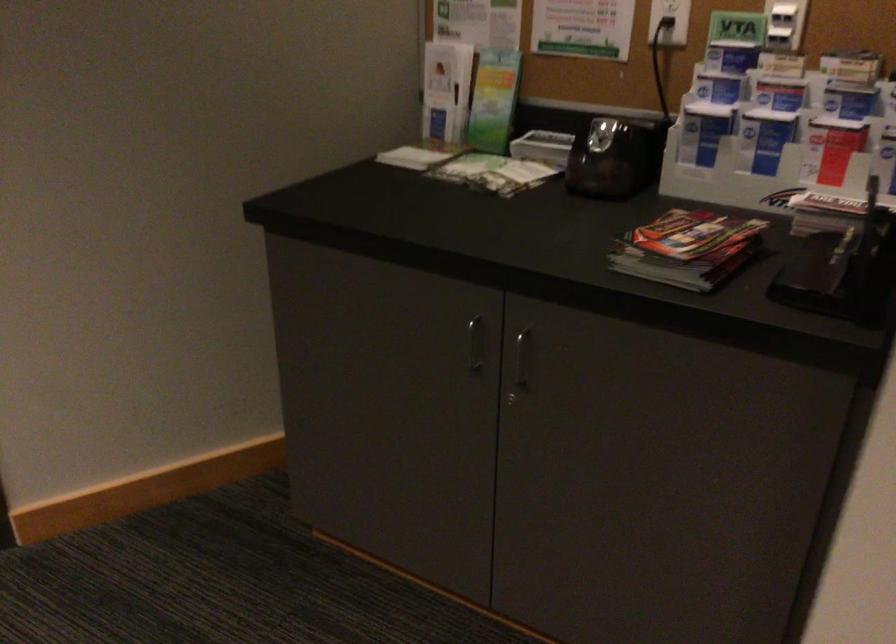
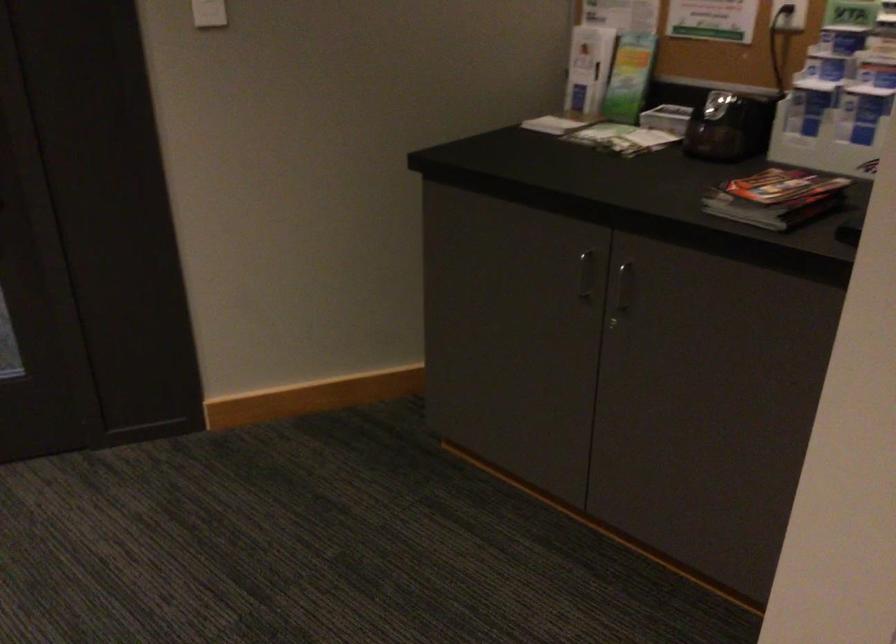
The point at (521, 364) is marked in the first image. Where is the corresponding point in the second image?

(622, 292)